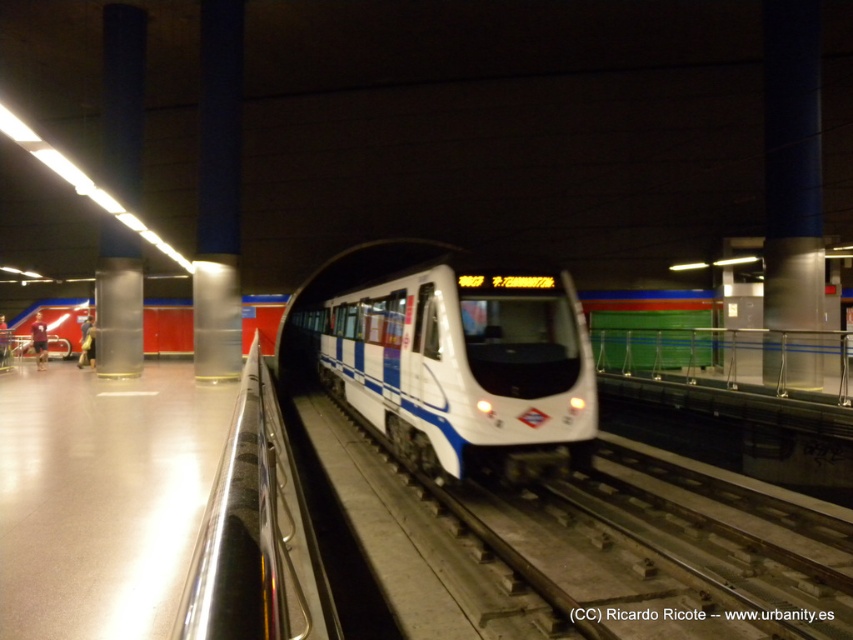
You are a commuter waiting at the subway station. You see the white glossy passenger train at center and the polished metal rail at center. Which object is closer to you as you stand on the platform?

The white glossy passenger train at center is closer to you because the polished metal rail at center is behind it.

You are a maintenance worker inspecting the subway station. You need to access the polished metal rail at center for repairs. However, the white glossy passenger train at center is currently blocking it. Can you safely move around the train to reach the rail?

The white glossy passenger train at center is positioned over polished metal rail at center, meaning the train is directly above the rail. Since the rail is underneath the train, you cannot safely move around the train to reach the rail as it is obstructed by the train itself.

You are a maintenance worker checking the subway station. You need to determine if the white glossy passenger train at center can pass under a low clearance tunnel section that is exactly the height of the polished metal rail at center. Can it?

The white glossy passenger train at center is taller than the polished metal rail at center. Since the tunnel section has a clearance equal to the height of the polished metal rail at center, the train cannot pass under it due to its greater height.